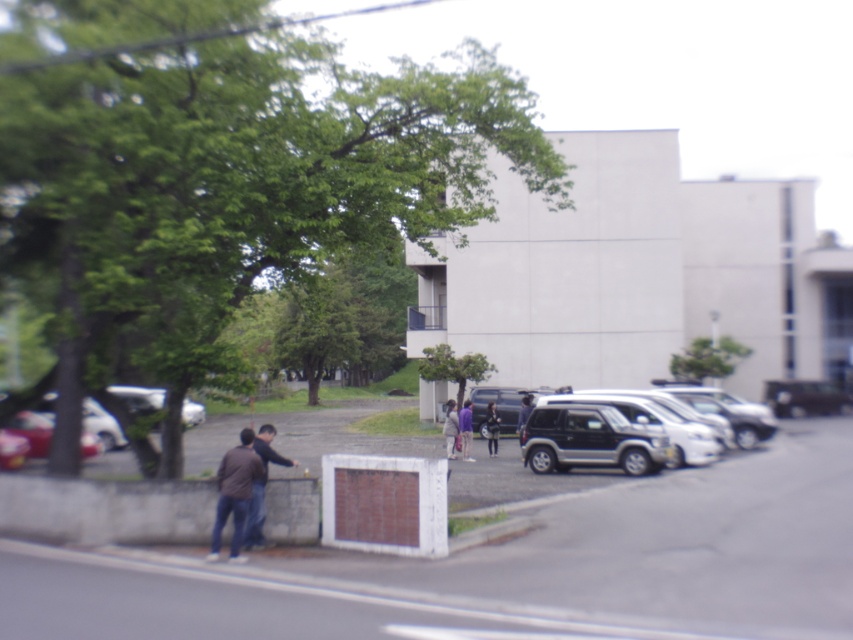
Question: In this image, where is metallic silver suv at right located relative to light brown leather jacket at center?

Choices:
 (A) below
 (B) above

Answer: (B)

Question: Can you confirm if silver metallic car at left is thinner than light brown leather jacket at center?

Choices:
 (A) yes
 (B) no

Answer: (B)

Question: Among these objects, which one is farthest from the camera?

Choices:
 (A) purple fabric person at center
 (B) light brown leather jacket at center
 (C) silver metallic car at left

Answer: (A)

Question: Does brown leather jacket at lower left appear under dark brown leather jacket at center?

Choices:
 (A) no
 (B) yes

Answer: (A)

Question: Which of the following is the closest to the observer?

Choices:
 (A) (469, 401)
 (B) (238, 444)

Answer: (B)

Question: Which point appears closest to the camera in this image?

Choices:
 (A) (558, 433)
 (B) (260, 438)

Answer: (B)